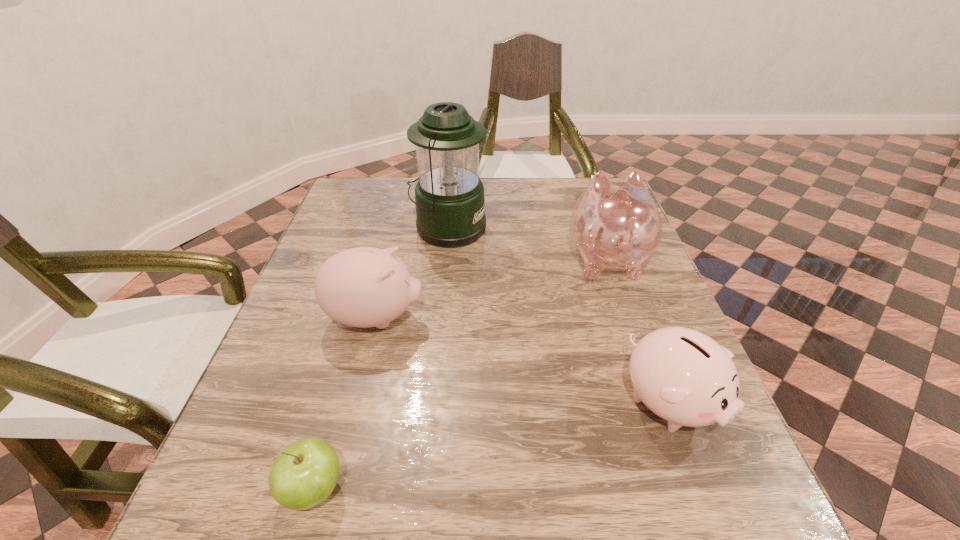
At what (x,y) coordinates should I click in order to perform the action: click on vacant space located 0.270m on the front facing side of the tallest piggy bank. Please return your answer as a coordinate pair (x, y). The width and height of the screenshot is (960, 540). Looking at the image, I should click on 580,181.

Image resolution: width=960 pixels, height=540 pixels. In order to click on free space located 0.100m on the front facing side of the tallest piggy bank in this screenshot , I will do `click(590, 211)`.

Locate an element on the screen. The height and width of the screenshot is (540, 960). free spot located at the snout of the leftmost piggy bank is located at coordinates (543, 318).

Find the location of a particular element. This screenshot has width=960, height=540. vacant region located 0.340m on the back of the nearest piggy bank is located at coordinates (613, 252).

Locate an element on the screen. The width and height of the screenshot is (960, 540). free space located on the right of the shortest object is located at coordinates (420, 489).

Image resolution: width=960 pixels, height=540 pixels. I want to click on object that is at the far edge, so click(450, 205).

This screenshot has width=960, height=540. Find the location of `object located at the near edge`. object located at the near edge is located at coordinates (304, 474).

Identify the location of piggy bank at the left edge. (363, 287).

You are a GUI agent. You are given a task and a screenshot of the screen. Output one action in this format:
    pyautogui.click(x=<x>, y=<y>)
    Task: Click on the apple located at the left edge
    
    Given the screenshot: What is the action you would take?
    pyautogui.click(x=304, y=474)

The width and height of the screenshot is (960, 540). Identify the location of object positioned at the near left corner. (304, 474).